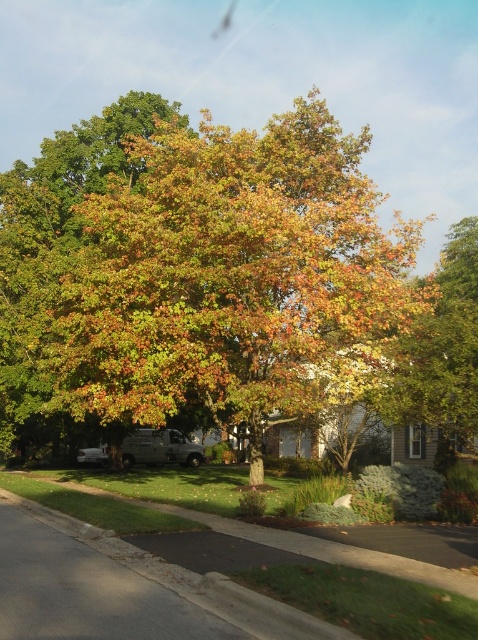
Question: Among these objects, which one is nearest to the camera?

Choices:
 (A) multicolored foliage at center
 (B) yellow-green foliage at center

Answer: (A)

Question: Is multicolored foliage at center positioned in front of yellow-green foliage at center?

Choices:
 (A) no
 (B) yes

Answer: (B)

Question: In this image, where is multicolored foliage at center located relative to yellow-green foliage at center?

Choices:
 (A) below
 (B) above

Answer: (B)

Question: Is multicolored foliage at center thinner than yellow-green foliage at center?

Choices:
 (A) yes
 (B) no

Answer: (B)